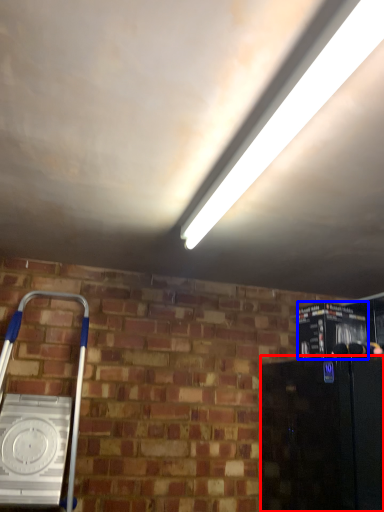
Question: Among these objects, which one is farthest to the camera, appliance (highlighted by a red box) or appliance (highlighted by a blue box)?

Choices:
 (A) appliance
 (B) appliance

Answer: (B)